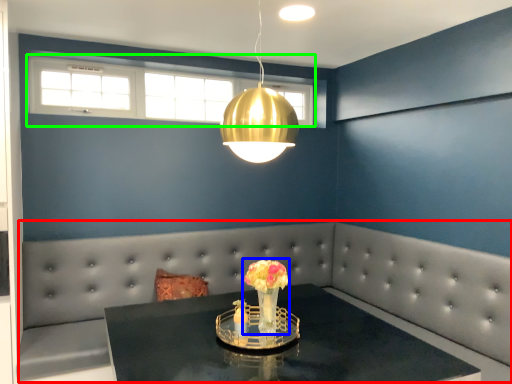
Question: Based on their relative distances, which object is nearer to couch (highlighted by a red box)? Choose from floral arrangement (highlighted by a blue box) and window (highlighted by a green box).

Choices:
 (A) floral arrangement
 (B) window

Answer: (B)